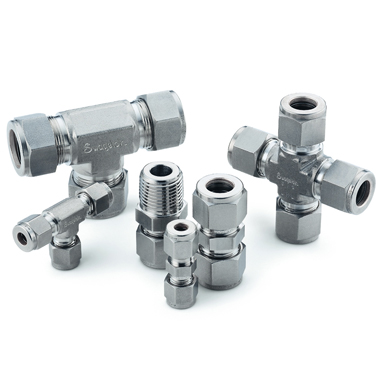
I want to click on fittings, so (309, 175), (112, 155).